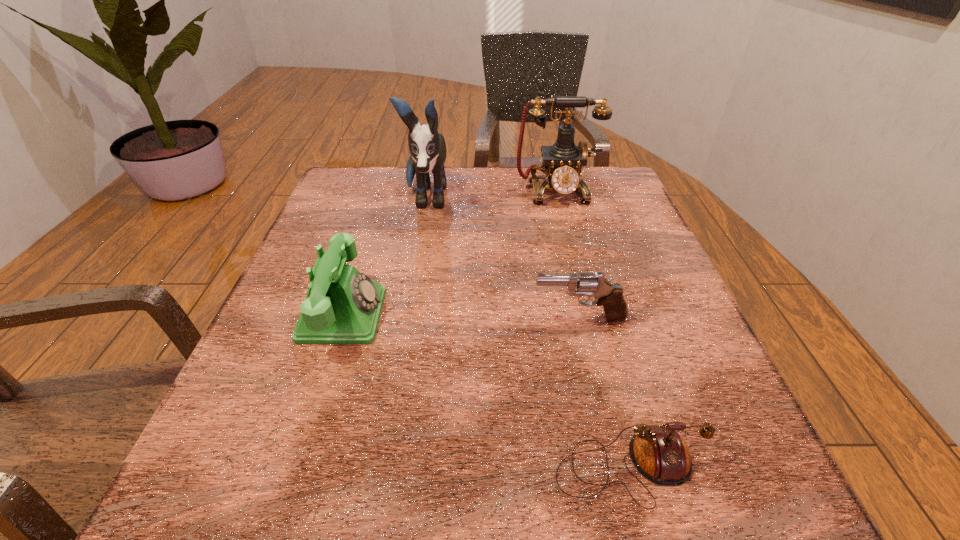
At what (x,y) coordinates should I click in order to perform the action: click on vacant region located 0.170m on the dial of the leftmost telephone. Please return your answer as a coordinate pair (x, y). Looking at the image, I should click on (477, 315).

At what (x,y) coordinates should I click in order to perform the action: click on free space located at the barrel of the fourth tallest object. Please return your answer as a coordinate pair (x, y). Looking at the image, I should click on (369, 319).

The image size is (960, 540). What are the coordinates of `vacant space located 0.240m at the barrel of the fourth tallest object` in the screenshot? It's located at (397, 319).

In order to click on vacant region located 0.240m at the barrel of the fourth tallest object in this screenshot , I will do `click(397, 319)`.

You are a GUI agent. You are given a task and a screenshot of the screen. Output one action in this format:
    pyautogui.click(x=<x>, y=<y>)
    Task: Click on the puppy that is positioned at the far edge
    This screenshot has height=540, width=960.
    Given the screenshot: What is the action you would take?
    click(x=427, y=147)

Locate an element on the screen. telephone present at the far edge is located at coordinates (562, 162).

What are the coordinates of `object present at the near edge` in the screenshot? It's located at (658, 452).

Image resolution: width=960 pixels, height=540 pixels. Find the location of `object present at the left edge`. object present at the left edge is located at coordinates (343, 306).

The height and width of the screenshot is (540, 960). Find the location of `pistol present at the right edge`. pistol present at the right edge is located at coordinates (610, 296).

Where is `object that is at the far right corner`? This screenshot has height=540, width=960. object that is at the far right corner is located at coordinates (562, 162).